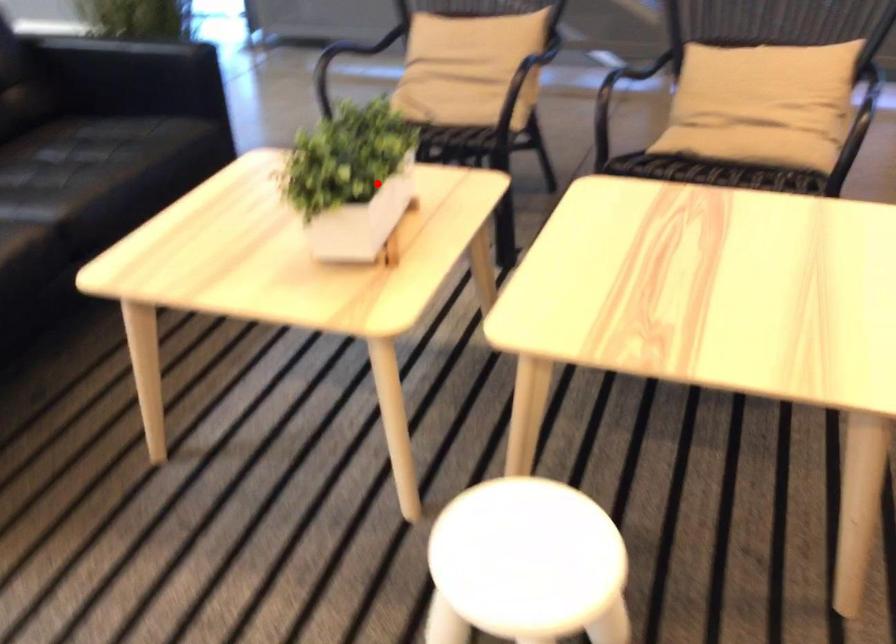
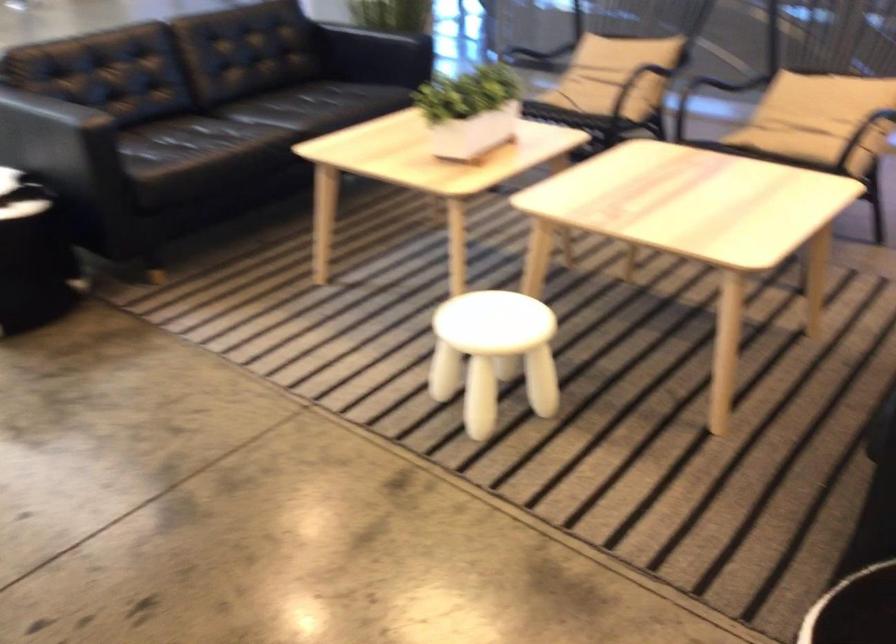
In the second image, find the point that corresponds to the highlighted location in the first image.

(470, 111)